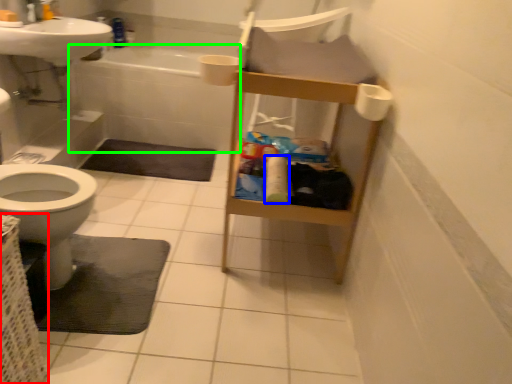
Question: Based on their relative distances, which object is nearer to basket (highlighted by a red box)? Choose from toilet paper (highlighted by a blue box) and bath (highlighted by a green box).

Choices:
 (A) toilet paper
 (B) bath

Answer: (A)